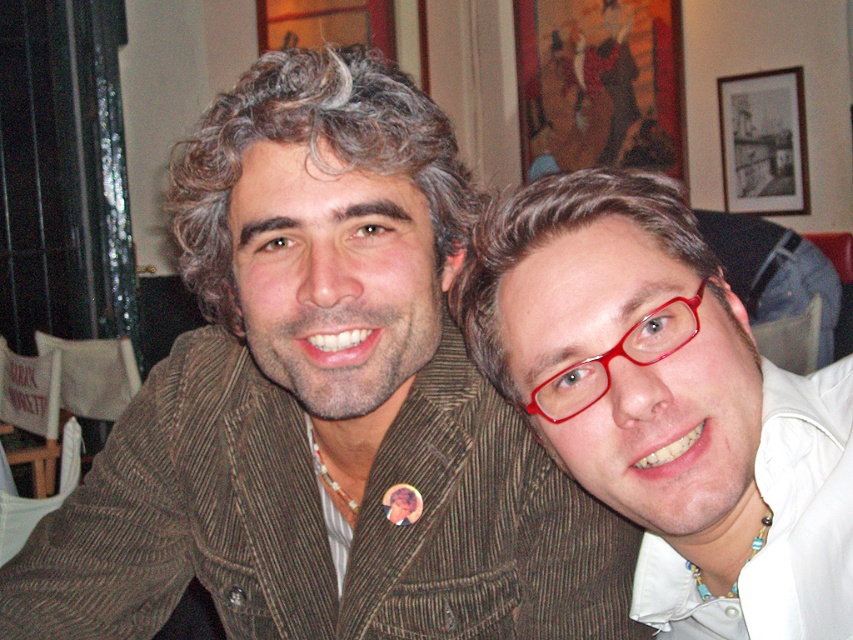
You are taking a photo of two people sitting at a table. You want to focus on the person closer to the camera. Which point should you focus on, point (x=248, y=211) or point (x=759, y=556)?

You should focus on point (x=248, y=211) because it is closer to the camera than point (x=759, y=556).

You are standing in the same room as the two people in the image. You want to move from the point labeled as point (219,349) to the point labeled as point (756,182). Which direction should you move to reach your destination?

To move from point (219,349) to point (756,182), you should move backward since point (219,349) is in front of point (756,182).